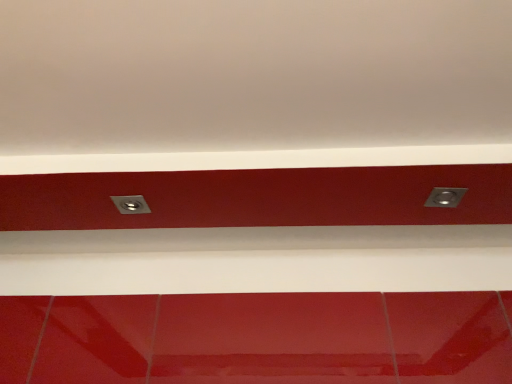
Question: Considering their positions, is metallic silver socket at center, the second power plugs and sockets viewed from the right, located in front of or behind metallic silver power plug/socket at upper right, which appears as the second power plugs and sockets when viewed from the left?

Choices:
 (A) behind
 (B) front

Answer: (A)

Question: Would you say metallic silver socket at center, the second power plugs and sockets viewed from the right, is to the left or to the right of metallic silver power plug/socket at upper right, which appears as the second power plugs and sockets when viewed from the left, in the picture?

Choices:
 (A) left
 (B) right

Answer: (A)

Question: From a real-world perspective, is metallic silver socket at center, positioned as the 1th power plugs and sockets in left-to-right order, physically located above or below metallic silver power plug/socket at upper right, which appears as the second power plugs and sockets when viewed from the left?

Choices:
 (A) below
 (B) above

Answer: (B)

Question: Considering their positions, is metallic silver power plug/socket at upper right, which appears as the second power plugs and sockets when viewed from the left, located in front of or behind metallic silver socket at center, the second power plugs and sockets viewed from the right?

Choices:
 (A) behind
 (B) front

Answer: (B)

Question: In terms of width, does metallic silver power plug/socket at upper right, the 1th power plugs and sockets viewed from the right, look wider or thinner when compared to metallic silver socket at center, the second power plugs and sockets viewed from the right?

Choices:
 (A) wide
 (B) thin

Answer: (B)

Question: Is point (443, 192) closer or farther from the camera than point (141, 213)?

Choices:
 (A) farther
 (B) closer

Answer: (B)

Question: Based on their sizes in the image, would you say metallic silver power plug/socket at upper right, which appears as the second power plugs and sockets when viewed from the left, is bigger or smaller than metallic silver socket at center, the second power plugs and sockets viewed from the right?

Choices:
 (A) small
 (B) big

Answer: (B)